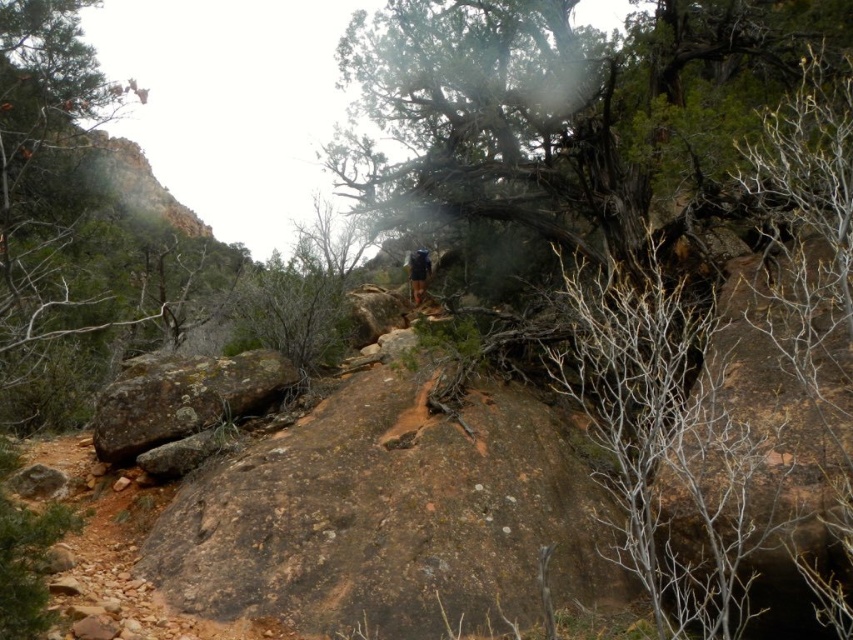
Is rusty brown rock at lower left to the left of dark blue jacket at center from the viewer's perspective?

Correct, you'll find rusty brown rock at lower left to the left of dark blue jacket at center.

Does rusty brown rock at lower left have a lesser height compared to dark blue jacket at center?

Indeed, rusty brown rock at lower left has a lesser height compared to dark blue jacket at center.

What do you see at coordinates (183, 397) in the screenshot? I see `rusty brown rock at lower left` at bounding box center [183, 397].

The width and height of the screenshot is (853, 640). What are the coordinates of `rusty brown rock at lower left` in the screenshot? It's located at (183, 397).